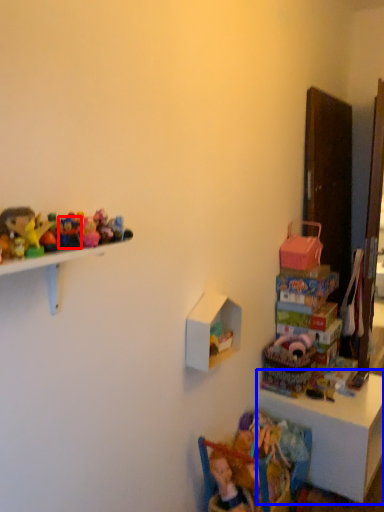
Question: Which object appears farthest to the camera in this image, toy (highlighted by a red box) or table (highlighted by a blue box)?

Choices:
 (A) toy
 (B) table

Answer: (B)